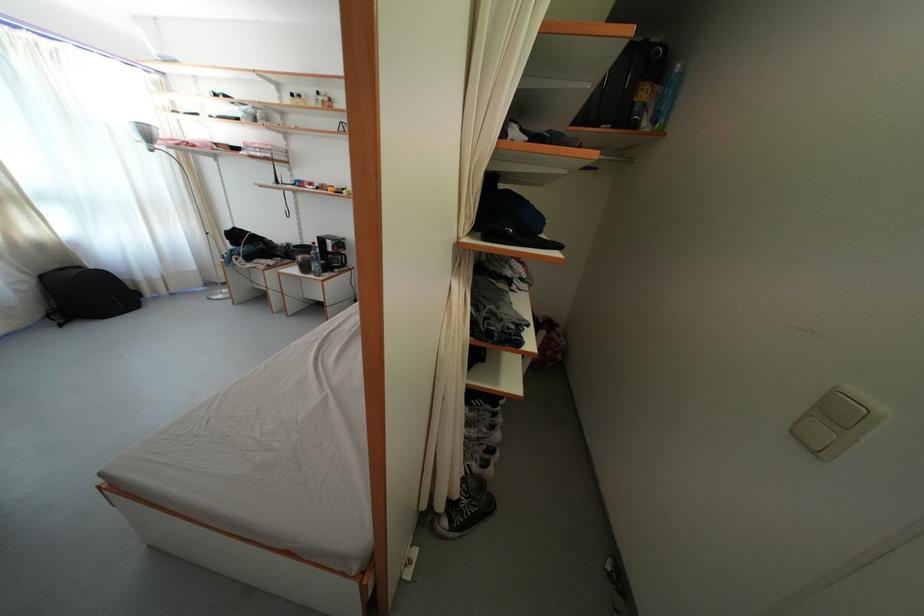
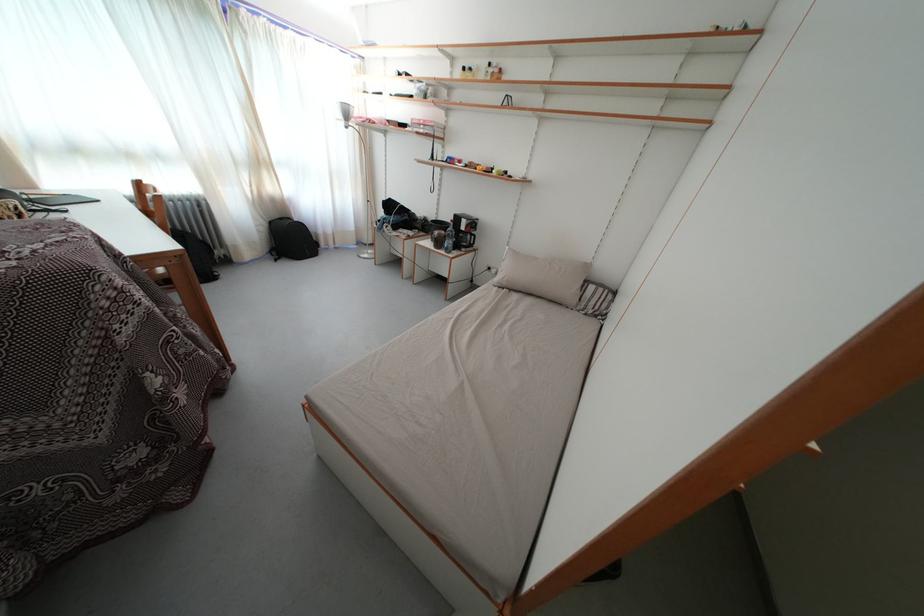
In the second image, find the point that corresponds to the point at 311,274 in the first image.

(444, 249)